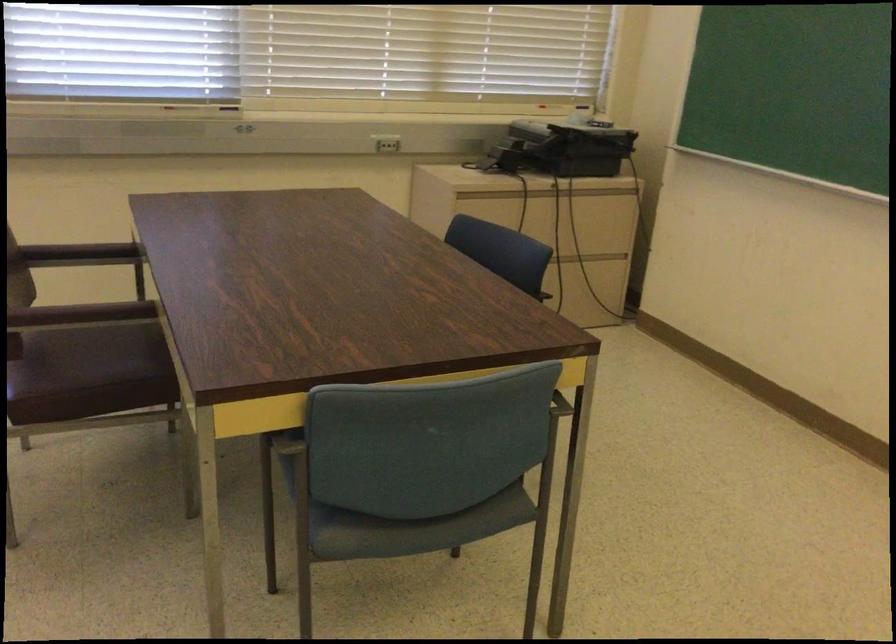
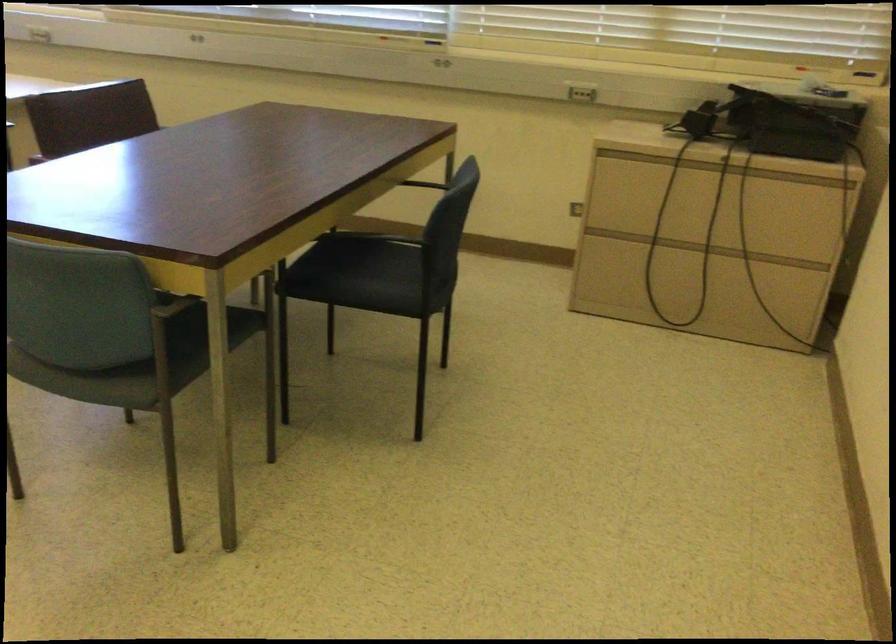
In the second image, find the point that corresponds to point 459,469 in the first image.

(173, 359)